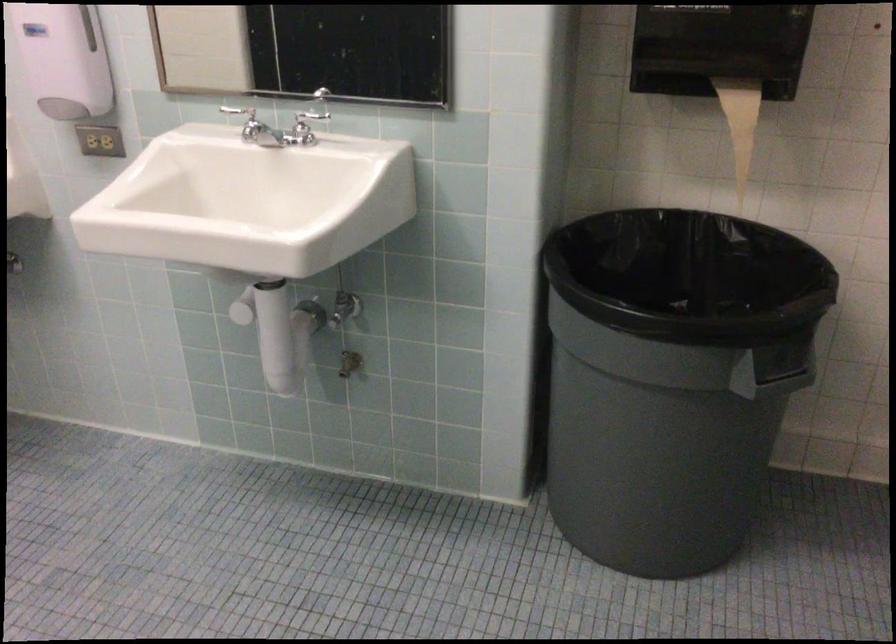
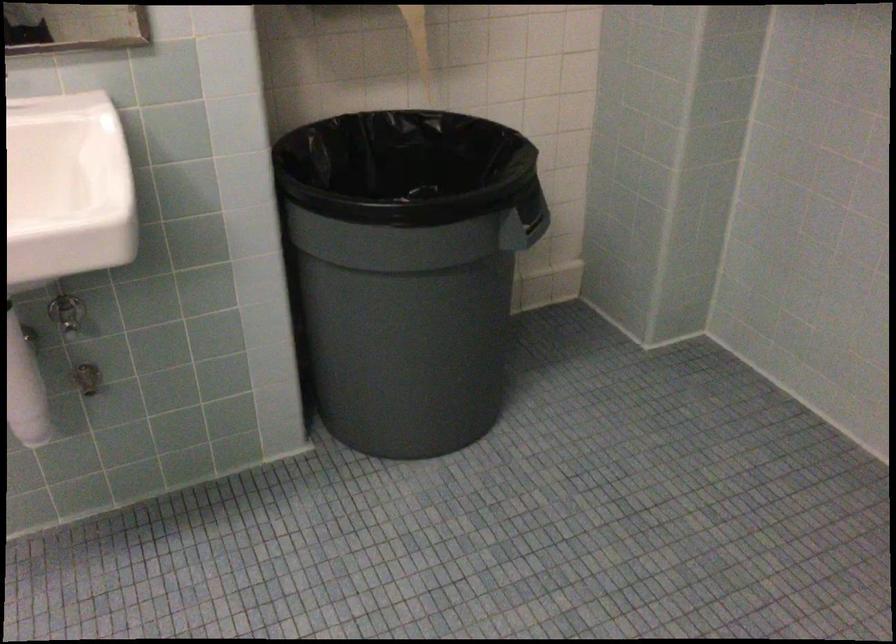
Locate, in the second image, the point that corresponds to (x=561, y=348) in the first image.

(332, 272)